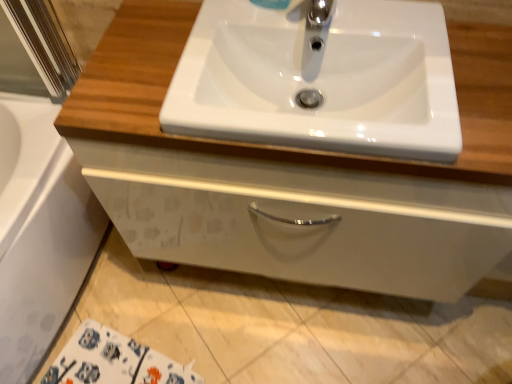
Locate an element on the screen. The height and width of the screenshot is (384, 512). vacant point above white glossy cabinet at center (from a real-world perspective) is located at coordinates (344, 116).